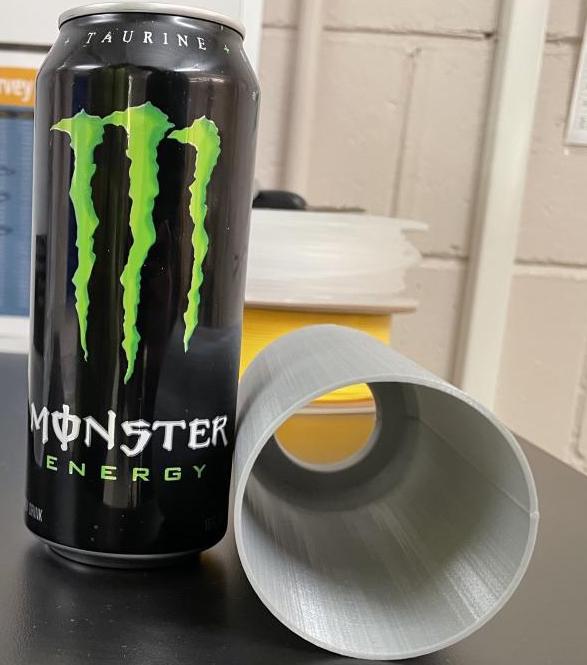
Locate an element on the screen. The width and height of the screenshot is (587, 665). white poster is located at coordinates (575, 132).